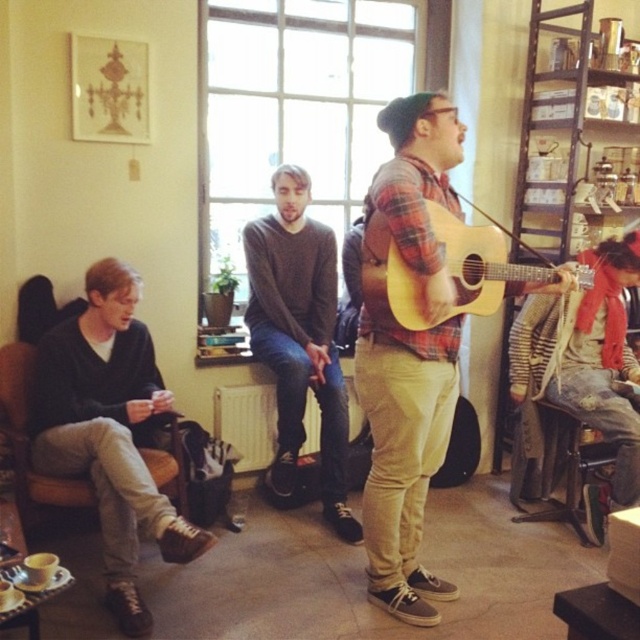
You are a photographer standing at the entrance of the room. You want to take a photo of the matte plaid shirt at center and the wooden stool at lower right in the same frame. Can you position yourself so that both are in the shot without moving any objects?

The distance between the matte plaid shirt at center and the wooden stool at lower right is 3.44 feet, so yes, you can position yourself at a distance where both objects are within the camera frame as they are relatively close to each other.

In the scene shown: You are a photographer trying to capture a group photo of the performers. You notice the matte plaid shirt at center and the dark gray sweater at center. Which clothing item should you focus on to ensure both are in frame without zooming in or out?

The matte plaid shirt at center is wider than the dark gray sweater at center, so focusing on the matte plaid shirt at center will ensure both are in frame without needing to adjust the zoom.

You are a photographer positioned in the room. You want to take a photo that includes both the matte plaid shirt at center and the dark gray sweater at center. What is the minimum distance you need to move backward to ensure both are in frame?

The minimum distance to move backward is 33.77 inches to ensure both the matte plaid shirt at center and the dark gray sweater at center are in frame.